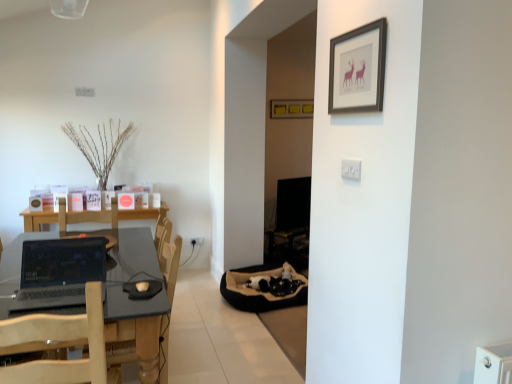
Question: Should I look upward or downward to see matte black picture frame at upper center, arranged as the second picture frame when viewed from the back?

Choices:
 (A) up
 (B) down

Answer: (A)

Question: Which direction should I rotate to look at matte yellow picture frame at center, arranged as the 2th picture frame when viewed from the front, — up or down?

Choices:
 (A) up
 (B) down

Answer: (A)

Question: From the image's perspective, would you say matte black picture frame at upper center, the 2th picture frame viewed from the top, is shown under white plastic electric outlet at upper center, the first electric outlet when ordered from front to back?

Choices:
 (A) yes
 (B) no

Answer: (B)

Question: Can you confirm if matte black picture frame at upper center, the 1th picture frame ordered from the bottom, is shorter than white plastic electric outlet at upper center, marked as the 1th electric outlet in a top-to-bottom arrangement?

Choices:
 (A) no
 (B) yes

Answer: (A)

Question: From the image's perspective, would you say matte black picture frame at upper center, the 2th picture frame viewed from the top, is positioned over white plastic electric outlet at upper center, the first electric outlet when ordered from front to back?

Choices:
 (A) no
 (B) yes

Answer: (B)

Question: Is matte black picture frame at upper center, the 2th picture frame viewed from the top, thinner than white plastic electric outlet at upper center, which ranks as the second electric outlet in back-to-front order?

Choices:
 (A) no
 (B) yes

Answer: (A)

Question: Can you confirm if matte black picture frame at upper center, the 2th picture frame viewed from the top, is smaller than white plastic electric outlet at upper center, which ranks as the second electric outlet in back-to-front order?

Choices:
 (A) no
 (B) yes

Answer: (A)

Question: Is matte black picture frame at upper center, the 1th picture frame ordered from the bottom, positioned in front of white plastic electric outlet at upper center, marked as the 1th electric outlet in a top-to-bottom arrangement?

Choices:
 (A) no
 (B) yes

Answer: (B)

Question: Is matte yellow picture frame at center, arranged as the 2th picture frame when viewed from the front, not inside black glossy monitor at center?

Choices:
 (A) no
 (B) yes

Answer: (B)

Question: Can you confirm if matte yellow picture frame at center, the 1th picture frame viewed from the top, is positioned to the right of black glossy monitor at center?

Choices:
 (A) yes
 (B) no

Answer: (B)

Question: From the image's perspective, does matte yellow picture frame at center, arranged as the second picture frame when ordered from the bottom, appear higher than black glossy monitor at center?

Choices:
 (A) no
 (B) yes

Answer: (B)

Question: From a real-world perspective, is matte yellow picture frame at center, arranged as the 2th picture frame when viewed from the front, physically below black glossy monitor at center?

Choices:
 (A) no
 (B) yes

Answer: (A)

Question: Is the position of matte yellow picture frame at center, arranged as the 2th picture frame when viewed from the front, more distant than that of black glossy monitor at center?

Choices:
 (A) yes
 (B) no

Answer: (A)

Question: Is matte yellow picture frame at center, arranged as the second picture frame when ordered from the bottom, with black glossy monitor at center?

Choices:
 (A) yes
 (B) no

Answer: (B)

Question: Is there a large distance between wooden armchair at center and dark gray laminate table at left?

Choices:
 (A) yes
 (B) no

Answer: (B)